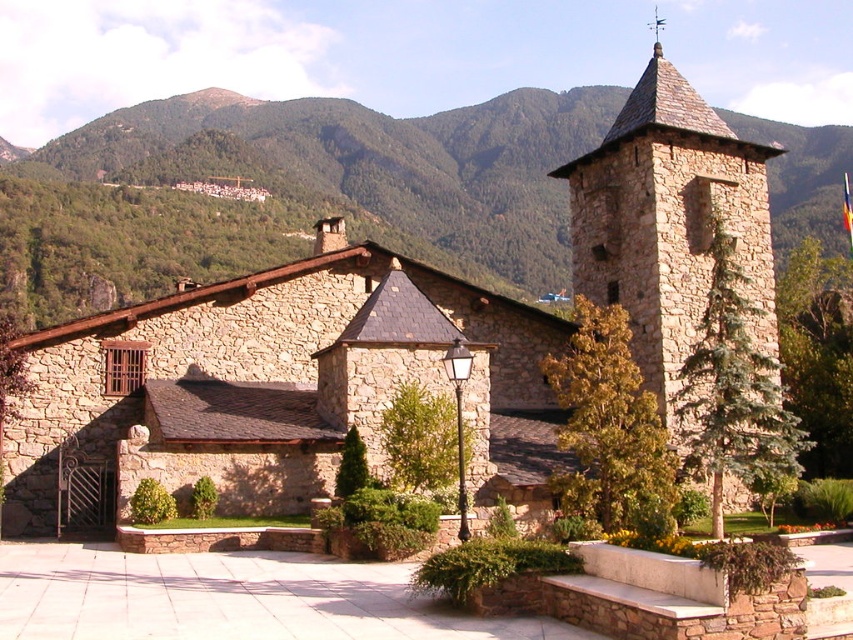
Is point (479, 467) positioned behind point (653, 32)?

No, it is not.

Is brown stone church at center positioned at the back of polished copper spire at upper center?

No, it is not.

Locate an element on the screen. This screenshot has height=640, width=853. brown stone church at center is located at coordinates (271, 385).

Can you confirm if brown stone church at center is positioned to the left of stone steeple at upper right?

Indeed, brown stone church at center is positioned on the left side of stone steeple at upper right.

Is brown stone church at center shorter than stone steeple at upper right?

Correct, brown stone church at center is not as tall as stone steeple at upper right.

Is point (341, 280) farther from camera compared to point (666, 396)?

Yes, point (341, 280) is behind point (666, 396).

This screenshot has height=640, width=853. Find the location of `brown stone church at center`. brown stone church at center is located at coordinates (271, 385).

Which is above, stone steeple at upper right or polished copper spire at upper center?

polished copper spire at upper center is higher up.

What do you see at coordinates (668, 221) in the screenshot? I see `stone steeple at upper right` at bounding box center [668, 221].

Which is behind, point (653, 376) or point (659, 38)?

The point (659, 38) is behind.

The width and height of the screenshot is (853, 640). Identify the location of stone steeple at upper right. (668, 221).